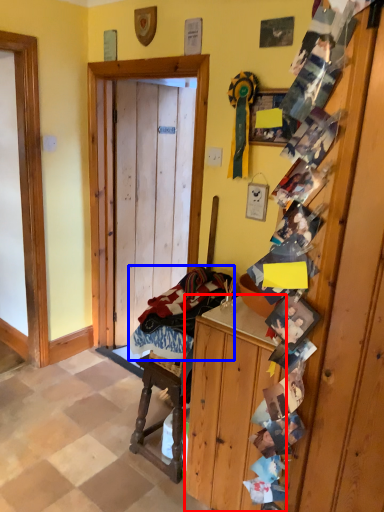
Question: Which object is closer to the camera taking this photo, cabinetry (highlighted by a red box) or laundry (highlighted by a blue box)?

Choices:
 (A) cabinetry
 (B) laundry

Answer: (A)